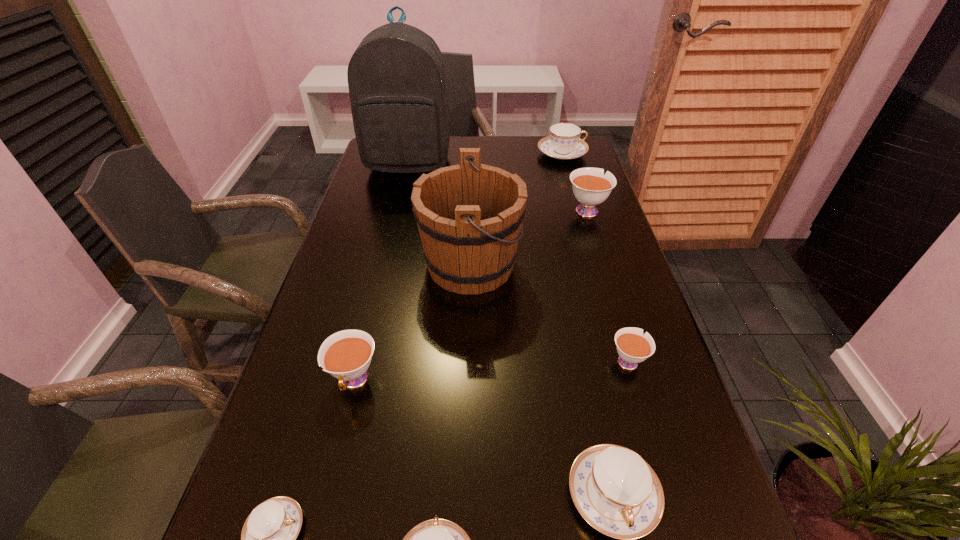
Find the location of a particular element. teacup present at the far edge is located at coordinates (564, 143).

At what (x,y) coordinates should I click in order to perform the action: click on backpack present at the left edge. Please return your answer as a coordinate pair (x, y). This screenshot has height=540, width=960. Looking at the image, I should click on (396, 77).

The height and width of the screenshot is (540, 960). Find the location of `teacup that is at the left edge`. teacup that is at the left edge is located at coordinates (346, 355).

The width and height of the screenshot is (960, 540). I want to click on object situated at the far left corner, so click(x=396, y=77).

Image resolution: width=960 pixels, height=540 pixels. In order to click on object that is at the far right corner in this screenshot , I will do (x=564, y=143).

At what (x,y) coordinates should I click in order to perform the action: click on free space at the left edge. Please return your answer as a coordinate pair (x, y). This screenshot has width=960, height=540. Looking at the image, I should click on (328, 329).

Locate an element on the screen. The height and width of the screenshot is (540, 960). vacant space at the right edge is located at coordinates (650, 318).

Where is `blank space at the far right corner`? Image resolution: width=960 pixels, height=540 pixels. blank space at the far right corner is located at coordinates (568, 160).

In order to click on free point between the biggest blue teacup and the smallest white teacup in this screenshot , I will do `click(594, 257)`.

At what (x,y) coordinates should I click in order to perform the action: click on unoccupied area between the farthest blue teacup and the smallest white teacup. Please return your answer as a coordinate pair (x, y). The image size is (960, 540). Looking at the image, I should click on (594, 257).